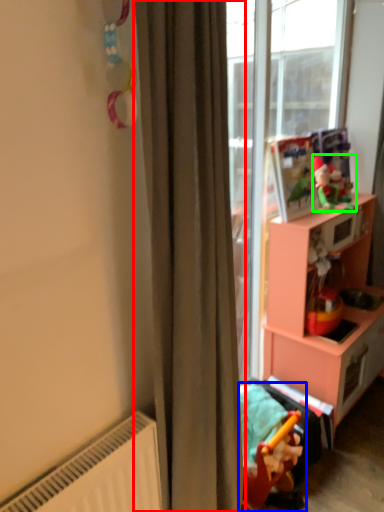
Question: Which object is the farthest from curtain (highlighted by a red box)? Choose among these: toy (highlighted by a blue box) or toy (highlighted by a green box).

Choices:
 (A) toy
 (B) toy

Answer: (B)